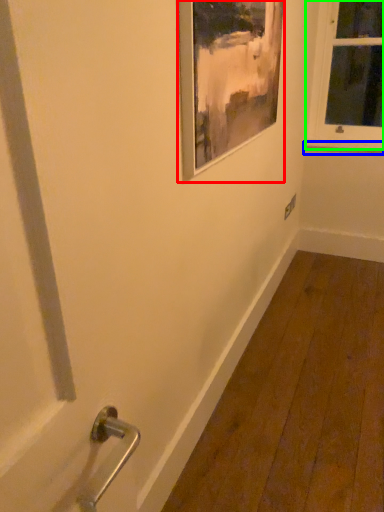
Question: Which object is the closest to the picture frame (highlighted by a red box)? Choose among these: window sill (highlighted by a blue box) or window (highlighted by a green box).

Choices:
 (A) window sill
 (B) window

Answer: (B)